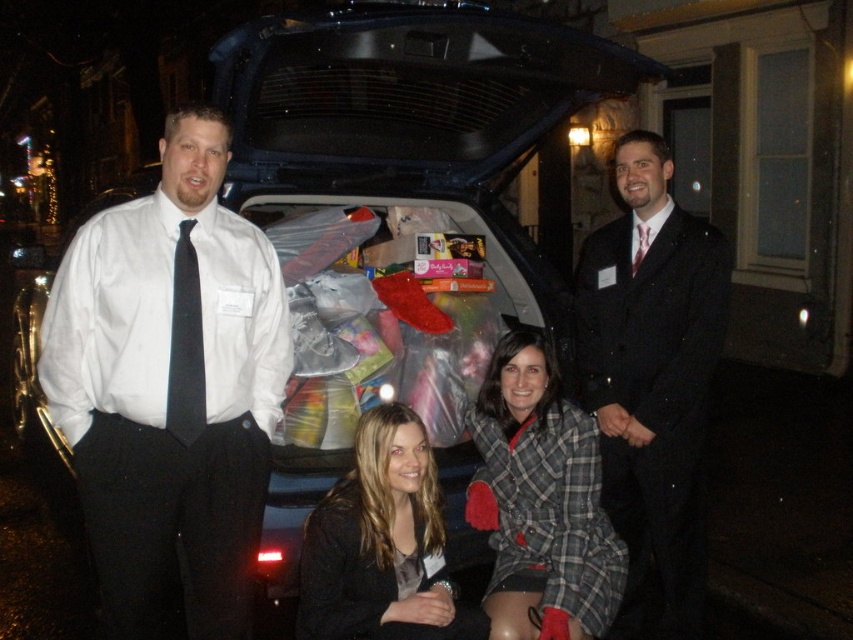
You are a photographer standing at the back of the car trunk. You need to capture a photo of both the matte black jacket at lower center and the black silk tie at center in the same frame. Given your camera has a minimum focusing distance of 1.5 meters, will you be able to take the photo without moving closer?

The matte black jacket at lower center is 1.53 meters away from the black silk tie at center. Since the minimum focusing distance is 1.5 meters, the photographer can take the photo without moving closer as the distance is just beyond the required minimum.

You are a photographer trying to capture a clear shot of the white shirt at left and the black satin tie at left. Since you want both to be in focus, which one should you adjust your camera focus on first?

The white shirt at left is closer to the viewer than the black satin tie at left, so you should focus on the white shirt at left first to ensure both are in focus.